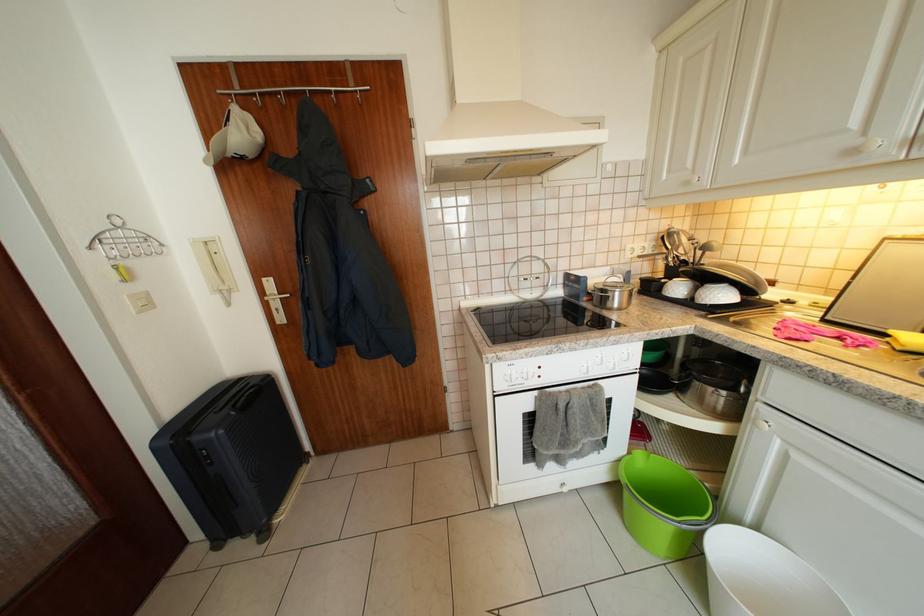
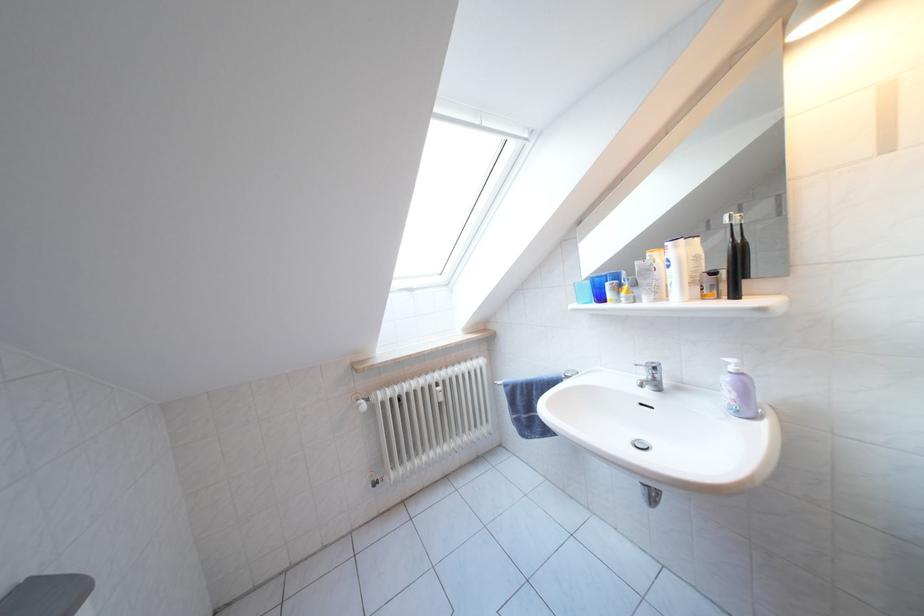
Question: The images are taken continuously from a first-person perspective. In which direction are you moving?

Choices:
 (A) Left
 (B) Right
 (C) Forward
 (D) Backward

Answer: (B)